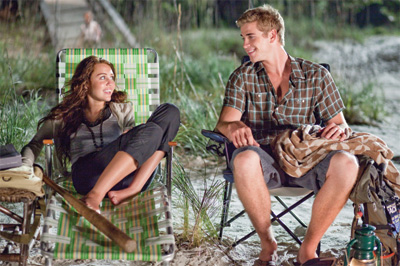
Identify the location of blanket. (316, 150).